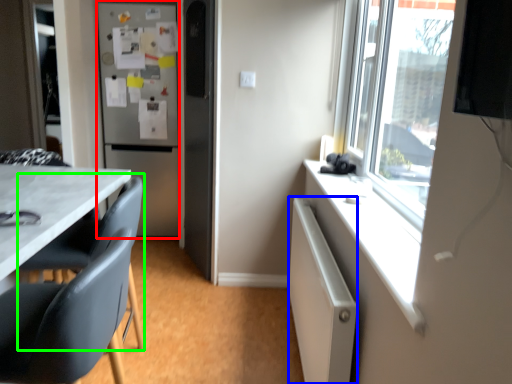
Question: Estimate the real-world distances between objects in this image. Which object is closer to refrigerator (highlighted by a red box), cabinetry (highlighted by a blue box) or swivel chair (highlighted by a green box)?

Choices:
 (A) cabinetry
 (B) swivel chair

Answer: (B)